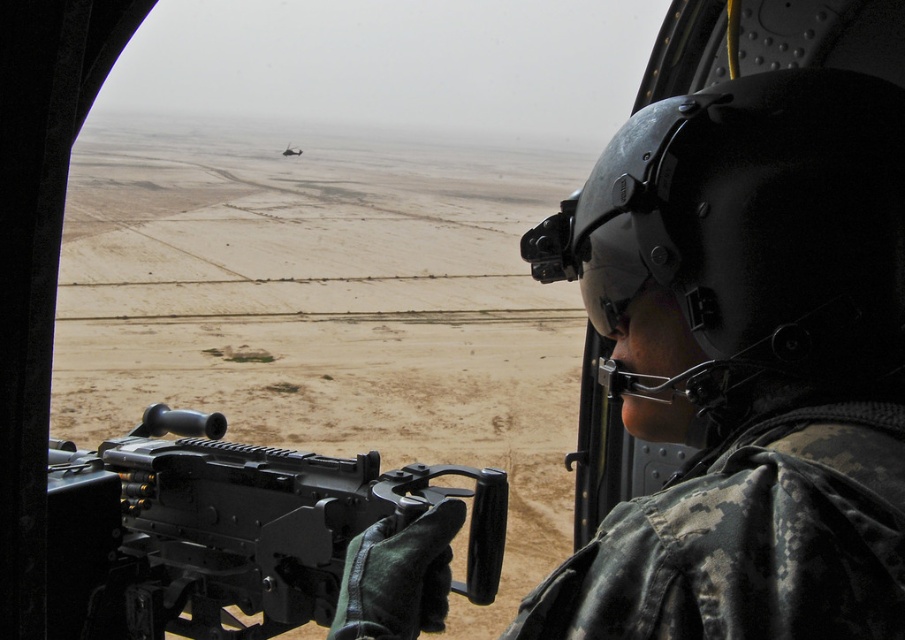
You are a soldier inside the helicopter. You need to hand the black matte rifle at center to the pilot sitting in the cockpit of the dark gray metallic helicopter at upper center. Can you reach the pilot directly without moving the rifle?

The black matte rifle at center is in front of the dark gray metallic helicopter at upper center, meaning the rifle is blocking the direct line to the pilot. You cannot reach the pilot directly without moving the rifle.

You are a military analyst examining the helicopter interior. You need to determine the spatial relationship between the black matte rifle at center and the dark gray metallic helicopter at upper center. From the soldier operator perspective, which object is on the right side?

The black matte rifle at center is positioned on the right side of the dark gray metallic helicopter at upper center, so from the soldier operator perspective, the black matte rifle at center is on the right side.

You are inside the military helicopter and want to know which of the two points, point (93, 545) or point (294, 150), is closer to you. Based on the coordinates provided, which point is nearer?

Point (93, 545) is closer to the camera than point (294, 150), so it is the nearer point.